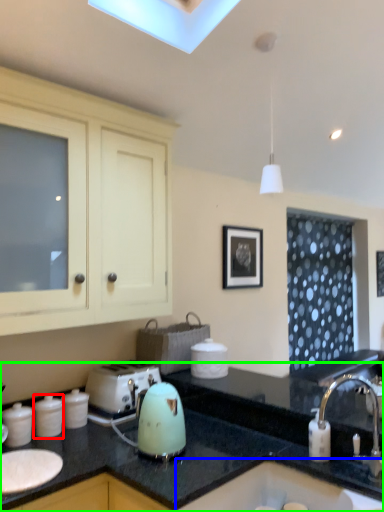
Question: Considering the real-world distances, which object is farthest from kitchen appliance (highlighted by a red box)? sink (highlighted by a blue box) or countertop (highlighted by a green box)?

Choices:
 (A) sink
 (B) countertop

Answer: (A)